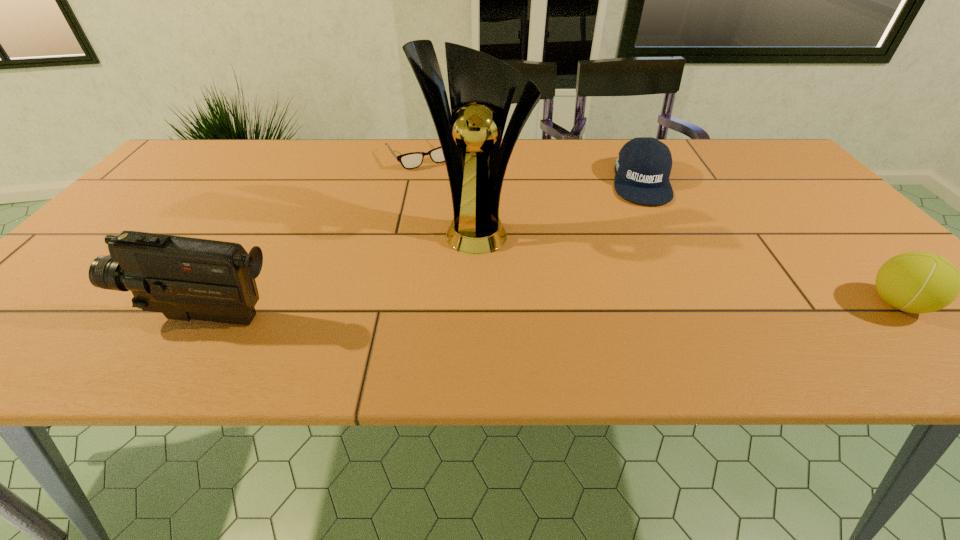
Find the location of a particular element. This screenshot has height=540, width=960. blank space located 0.080m on the back of the rightmost object is located at coordinates (854, 259).

Find the location of a particular element. Image resolution: width=960 pixels, height=540 pixels. free space located 0.070m on the front-facing side of the fourth tallest object is located at coordinates (651, 223).

At what (x,y) coordinates should I click in order to perform the action: click on vacant space situated 0.280m on the front-facing side of the fourth tallest object. Please return your answer as a coordinate pair (x, y). Looking at the image, I should click on (660, 281).

You are a GUI agent. You are given a task and a screenshot of the screen. Output one action in this format:
    pyautogui.click(x=<x>, y=<y>)
    Task: Click on the free region located on the front-facing side of the fourth tallest object
    Image resolution: width=960 pixels, height=540 pixels.
    Given the screenshot: What is the action you would take?
    pyautogui.click(x=664, y=312)

At what (x,y) coordinates should I click in order to perform the action: click on vacant area situated 0.390m on the front-facing side of the shortest object. Please return your answer as a coordinate pair (x, y). The image size is (960, 540). Looking at the image, I should click on (491, 248).

Image resolution: width=960 pixels, height=540 pixels. In order to click on free space located 0.050m on the front-facing side of the shortest object in this screenshot , I will do `click(439, 178)`.

You are a GUI agent. You are given a task and a screenshot of the screen. Output one action in this format:
    pyautogui.click(x=<x>, y=<y>)
    Task: Click on the free region located on the front-facing side of the shortest object
    The width and height of the screenshot is (960, 540).
    Given the screenshot: What is the action you would take?
    pyautogui.click(x=480, y=234)

Where is `free location located 0.190m at the front of the tallest object, where the globe is visible`? free location located 0.190m at the front of the tallest object, where the globe is visible is located at coordinates (467, 319).

This screenshot has height=540, width=960. In order to click on vacant region located 0.170m at the front of the tallest object, where the globe is visible in this screenshot , I will do `click(467, 310)`.

What are the coordinates of `vacant space situated at the front of the tallest object, where the globe is visible` in the screenshot? It's located at (468, 307).